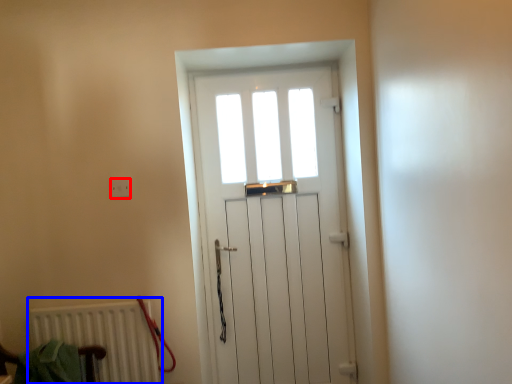
Question: Which object appears farthest to the camera in this image, electric outlet (highlighted by a red box) or radiator (highlighted by a blue box)?

Choices:
 (A) electric outlet
 (B) radiator

Answer: (A)